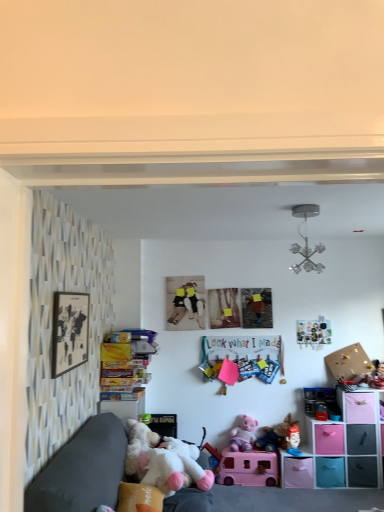
Question: Is metallic chandelier at upper center, marked as the 7th toy in a bottom-to-top arrangement, facing away from plush fabric toy at lower right, the 6th toy viewed from the top?

Choices:
 (A) yes
 (B) no

Answer: (B)

Question: Considering the relative sizes of metallic chandelier at upper center, placed as the 1th toy when sorted from top to bottom, and plush fabric toy at lower right, which ranks as the 2th toy in bottom-to-top order, in the image provided, is metallic chandelier at upper center, placed as the 1th toy when sorted from top to bottom, bigger than plush fabric toy at lower right, which ranks as the 2th toy in bottom-to-top order,?

Choices:
 (A) yes
 (B) no

Answer: (A)

Question: Does metallic chandelier at upper center, placed as the 1th toy when sorted from top to bottom, have a smaller size compared to plush fabric toy at lower right, which ranks as the 2th toy in bottom-to-top order?

Choices:
 (A) yes
 (B) no

Answer: (B)

Question: Can you confirm if metallic chandelier at upper center, placed as the 1th toy when sorted from top to bottom, is positioned to the left of plush fabric toy at lower right, which ranks as the 2th toy in bottom-to-top order?

Choices:
 (A) no
 (B) yes

Answer: (B)

Question: From a real-world perspective, is metallic chandelier at upper center, marked as the 7th toy in a bottom-to-top arrangement, on top of plush fabric toy at lower right, which ranks as the 2th toy in bottom-to-top order?

Choices:
 (A) yes
 (B) no

Answer: (A)

Question: Can you confirm if translucent plastic toy car at right, which ranks as the sixth toy in bottom-to-top order, is bigger than pink matte toy car at center, the 7th toy positioned from the top?

Choices:
 (A) yes
 (B) no

Answer: (B)

Question: Does translucent plastic toy car at right, which is the second toy from top to bottom, touch pink matte toy car at center, the 7th toy positioned from the top?

Choices:
 (A) yes
 (B) no

Answer: (B)

Question: Would you say translucent plastic toy car at right, which is the second toy from top to bottom, contains pink matte toy car at center, the 7th toy positioned from the top?

Choices:
 (A) no
 (B) yes

Answer: (A)

Question: Is translucent plastic toy car at right, which is the second toy from top to bottom, thinner than pink matte toy car at center, which is the first toy in bottom-to-top order?

Choices:
 (A) no
 (B) yes

Answer: (B)

Question: From a real-world perspective, does translucent plastic toy car at right, which ranks as the sixth toy in bottom-to-top order, stand above pink matte toy car at center, which is the first toy in bottom-to-top order?

Choices:
 (A) no
 (B) yes

Answer: (B)

Question: Can you confirm if plush fabric toy at lower right, the 6th toy viewed from the top, is taller than corkboard at upper right?

Choices:
 (A) no
 (B) yes

Answer: (A)